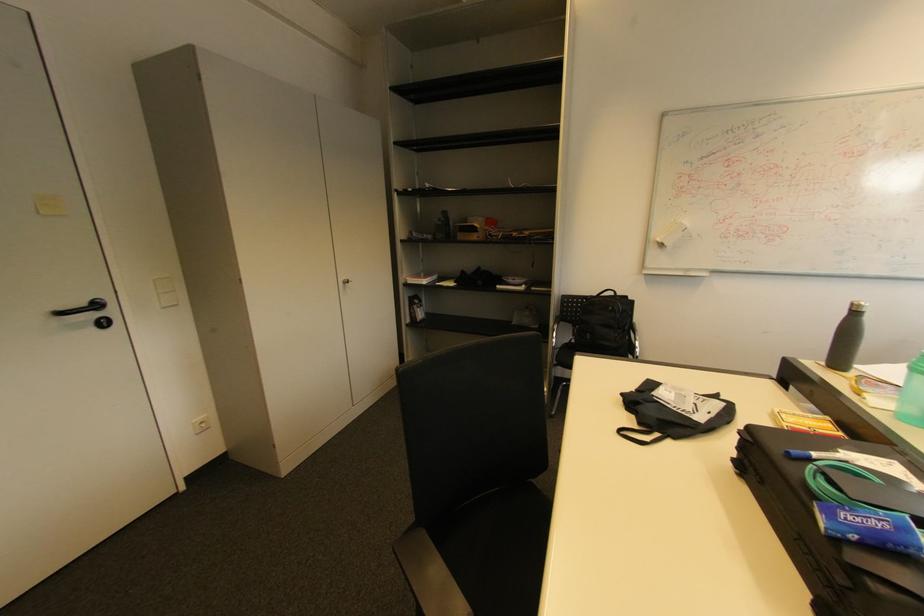
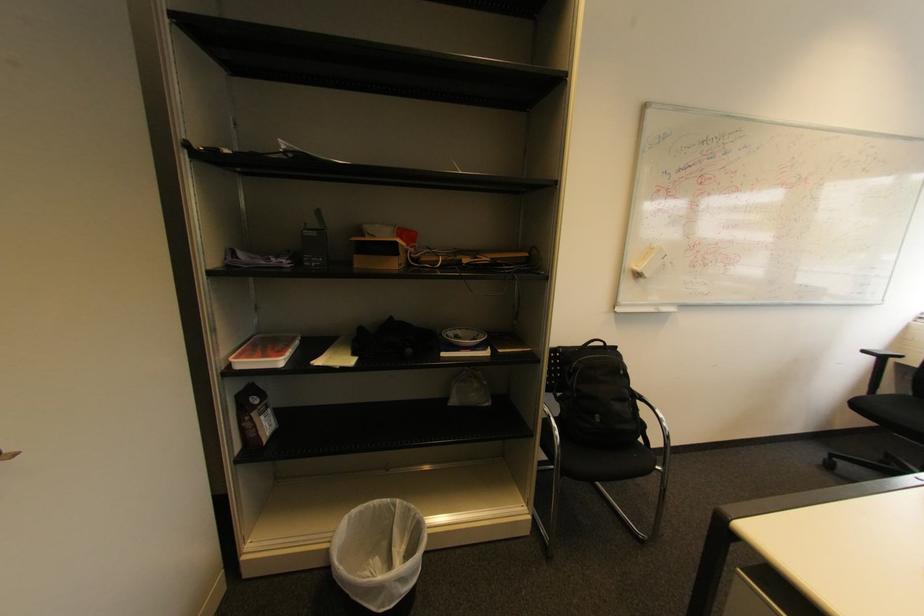
The point at [666,246] is marked in the first image. Where is the corresponding point in the second image?

(643, 276)